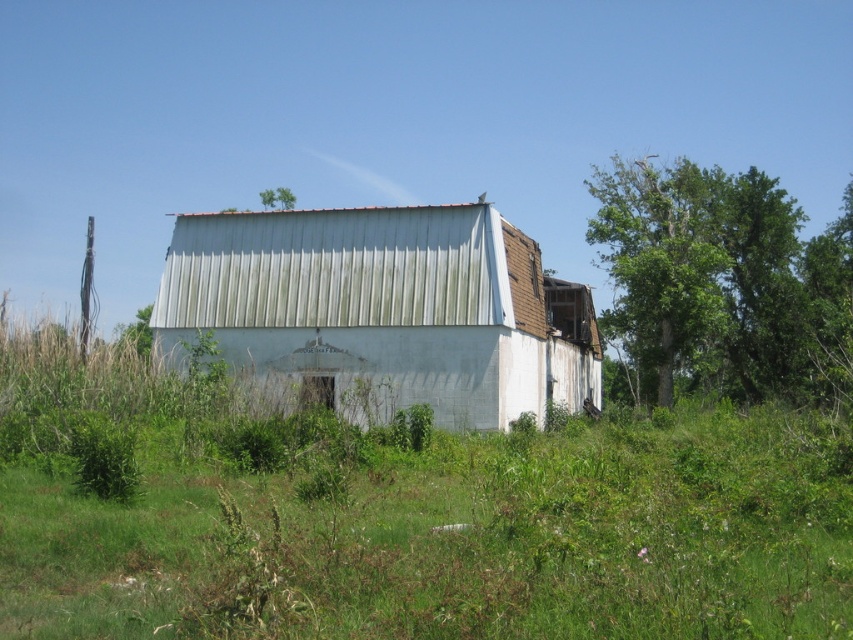
Based on the scene described, which object is taller between the white corrugated metal barn at center and the green leafy tree at upper center?

The green leafy tree at upper center is taller than the white corrugated metal barn at center.